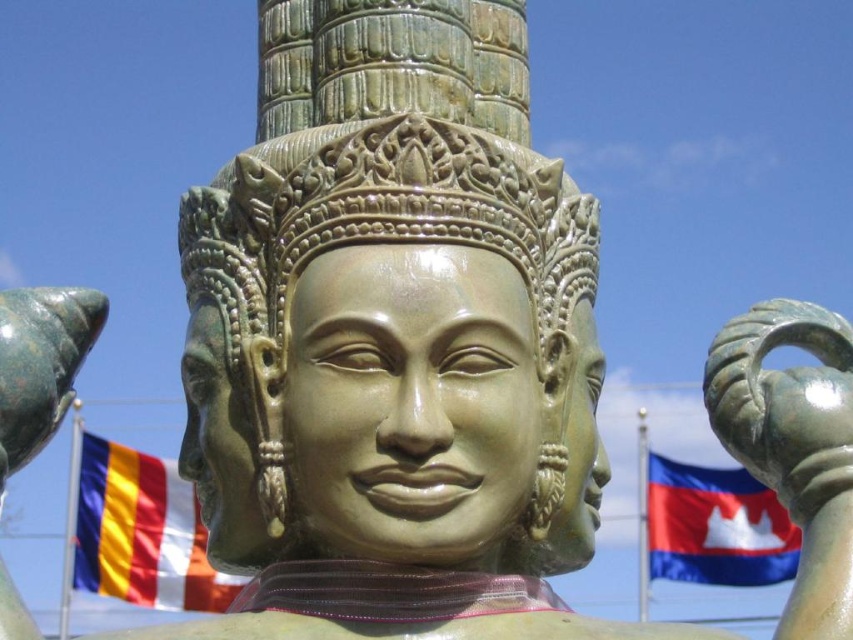
Question: Which of the following is the closest to the observer?

Choices:
 (A) (683, 577)
 (B) (503, 248)

Answer: (B)

Question: Is tri-colored fabric flag at center smaller than blue fabric flag at lower right?

Choices:
 (A) yes
 (B) no

Answer: (B)

Question: Among these points, which one is farthest from the camera?

Choices:
 (A) (202, 195)
 (B) (173, 560)
 (C) (712, 573)

Answer: (C)

Question: From the image, what is the correct spatial relationship of bronze statue at center in relation to blue fabric flag at lower right?

Choices:
 (A) left
 (B) right

Answer: (A)

Question: Can you confirm if tri-colored fabric flag at center is thinner than blue fabric flag at lower right?

Choices:
 (A) yes
 (B) no

Answer: (B)

Question: Which object is farther from the camera taking this photo?

Choices:
 (A) bronze statue at center
 (B) tri-colored fabric flag at center
 (C) blue fabric flag at lower right

Answer: (C)